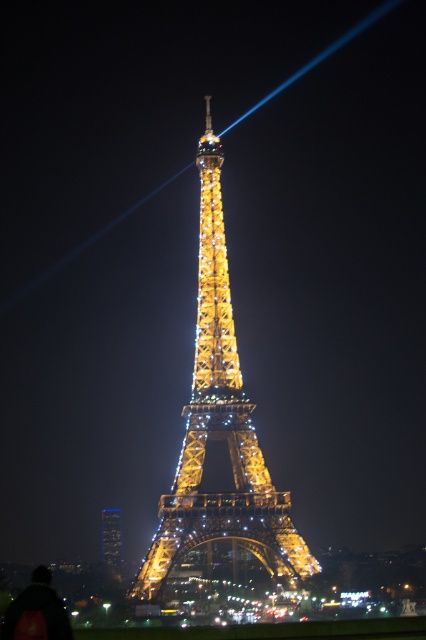
Does illuminated gold metal eiffel tower at center have a greater height compared to golden metallic eiffel tower at center?

Yes.

Is point (195, 412) less distant than point (108, 557)?

Yes, it is in front of point (108, 557).

This screenshot has height=640, width=426. Find the location of `illuminated gold metal eiffel tower at center`. illuminated gold metal eiffel tower at center is located at coordinates (221, 428).

Can you confirm if black fabric at lower left is positioned to the right of golden metallic eiffel tower at center?

Incorrect, black fabric at lower left is not on the right side of golden metallic eiffel tower at center.

Is black fabric at lower left shorter than golden metallic eiffel tower at center?

Incorrect, black fabric at lower left's height does not fall short of golden metallic eiffel tower at center's.

The image size is (426, 640). What are the coordinates of `black fabric at lower left` in the screenshot? It's located at (37, 611).

Which is in front, point (296, 556) or point (58, 630)?

Point (58, 630)

Describe the element at coordinates (221, 428) in the screenshot. Image resolution: width=426 pixels, height=640 pixels. I see `illuminated gold metal eiffel tower at center` at that location.

I want to click on illuminated gold metal eiffel tower at center, so click(x=221, y=428).